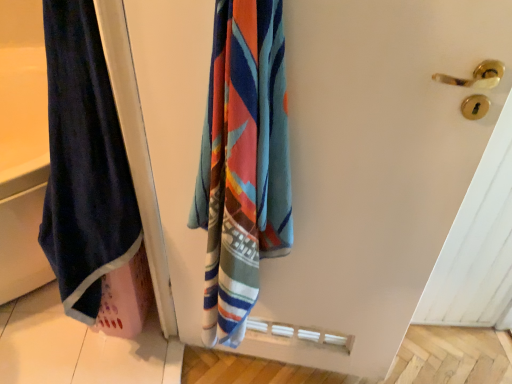
In order to face velvet dark blue towel at left, should I rotate leftwards or rightwards?

You should look right and rotate roughly 4.232 degrees.

The height and width of the screenshot is (384, 512). What do you see at coordinates (373, 170) in the screenshot? I see `velvet dark blue towel at left` at bounding box center [373, 170].

Identify the location of velvet dark blue towel at left. The image size is (512, 384). (373, 170).

Measure the distance between velvet dark blue towel at left and camera.

They are 84.97 centimeters apart.

The width and height of the screenshot is (512, 384). What are the coordinates of `velvet dark blue towel at left` in the screenshot? It's located at (84, 163).

The width and height of the screenshot is (512, 384). Describe the element at coordinates (84, 163) in the screenshot. I see `velvet dark blue towel at left` at that location.

Find the location of a particular element. velvet dark blue towel at left is located at coordinates 373,170.

From the picture: Is velvet dark blue towel at left at the left side of velvet dark blue towel at left?

Yes, velvet dark blue towel at left is to the left of velvet dark blue towel at left.

Is velvet dark blue towel at left further to the viewer compared to velvet dark blue towel at left?

Yes, velvet dark blue towel at left is further from the viewer.

Which point is more distant from viewer, (70, 309) or (439, 165)?

The point (70, 309) is farther.

Based on the photo, from the image's perspective, is velvet dark blue towel at left positioned above or below velvet dark blue towel at left?

velvet dark blue towel at left is situated higher than velvet dark blue towel at left in the image.

From a real-world perspective, is velvet dark blue towel at left positioned above or below velvet dark blue towel at left?

In terms of real-world spatial position, velvet dark blue towel at left is above velvet dark blue towel at left.

Which of these two, velvet dark blue towel at left or velvet dark blue towel at left, is thinner?

Thinner between the two is velvet dark blue towel at left.

Considering the relative sizes of velvet dark blue towel at left and velvet dark blue towel at left in the image provided, is velvet dark blue towel at left shorter than velvet dark blue towel at left?

Correct, velvet dark blue towel at left is not as tall as velvet dark blue towel at left.

Does velvet dark blue towel at left have a larger size compared to velvet dark blue towel at left?

Correct, velvet dark blue towel at left is larger in size than velvet dark blue towel at left.

Is velvet dark blue towel at left inside velvet dark blue towel at left?

No, velvet dark blue towel at left is not inside velvet dark blue towel at left.

Is velvet dark blue towel at left directly adjacent to velvet dark blue towel at left?

No, velvet dark blue towel at left is not beside velvet dark blue towel at left.

Is velvet dark blue towel at left looking in the opposite direction of velvet dark blue towel at left?

Absolutely, velvet dark blue towel at left is directed away from velvet dark blue towel at left.

How many degrees apart are the facing directions of velvet dark blue towel at left and velvet dark blue towel at left?

76 degrees.

Identify the location of towel above the velvet dark blue towel at left (from the image's perspective). The width and height of the screenshot is (512, 384). (84, 163).

Looking at this image, can you confirm if velvet dark blue towel at left is positioned to the left of velvet dark blue towel at left?

Incorrect, velvet dark blue towel at left is not on the left side of velvet dark blue towel at left.

Does velvet dark blue towel at left lie behind velvet dark blue towel at left?

→ No, velvet dark blue towel at left is in front of velvet dark blue towel at left.

Does point (181, 293) appear closer or farther from the camera than point (98, 241)?

Clearly, point (181, 293) is more distant from the camera than point (98, 241).

From the image's perspective, who appears lower, velvet dark blue towel at left or velvet dark blue towel at left?

From the image's view, velvet dark blue towel at left is below.

From a real-world perspective, between velvet dark blue towel at left and velvet dark blue towel at left, who is vertically lower?

In real-world perspective, velvet dark blue towel at left is lower.

Which of these two, velvet dark blue towel at left or velvet dark blue towel at left, is wider?

With larger width is velvet dark blue towel at left.

From their relative heights in the image, would you say velvet dark blue towel at left is taller or shorter than velvet dark blue towel at left?

velvet dark blue towel at left is taller than velvet dark blue towel at left.

Between velvet dark blue towel at left and velvet dark blue towel at left, which one has smaller size?

velvet dark blue towel at left.

Can velvet dark blue towel at left be found inside velvet dark blue towel at left?

Actually, velvet dark blue towel at left is outside velvet dark blue towel at left.

Is velvet dark blue towel at left not near velvet dark blue towel at left?

No, velvet dark blue towel at left is not far away from velvet dark blue towel at left.

Is velvet dark blue towel at left aimed at velvet dark blue towel at left?

No, velvet dark blue towel at left is not oriented towards velvet dark blue towel at left.

Identify the location of towel behind the velvet dark blue towel at left. The height and width of the screenshot is (384, 512). (84, 163).

Where is `screen door that appears below the velvet dark blue towel at left (from the image's perspective)`? screen door that appears below the velvet dark blue towel at left (from the image's perspective) is located at coordinates (x=373, y=170).

The height and width of the screenshot is (384, 512). Find the location of `screen door directly beneath the velvet dark blue towel at left (from a real-world perspective)`. screen door directly beneath the velvet dark blue towel at left (from a real-world perspective) is located at coordinates (373, 170).